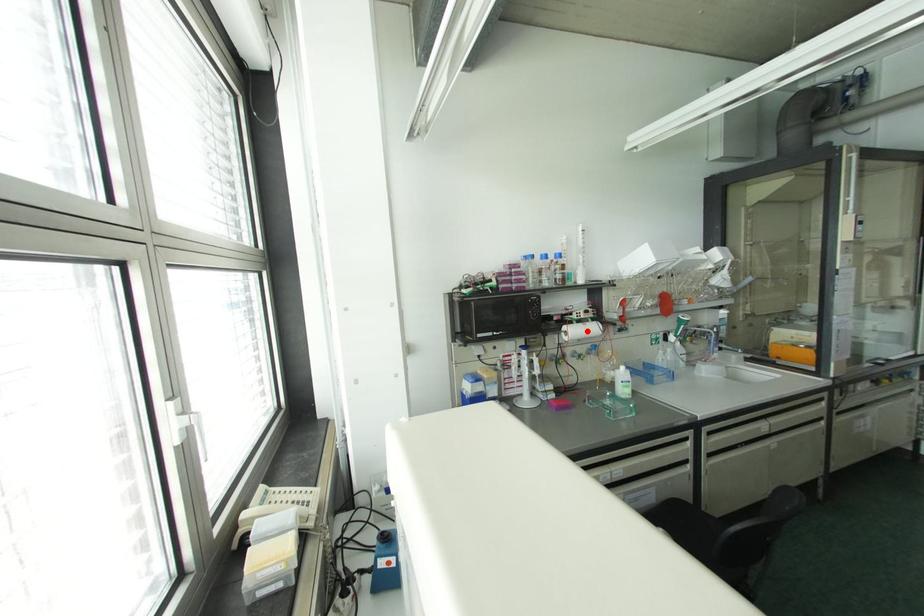
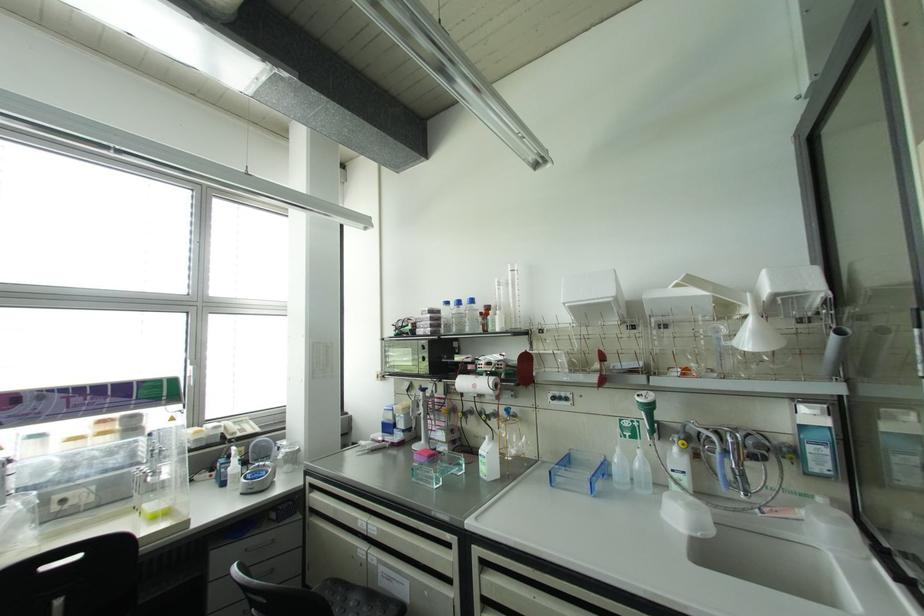
Where in the second image is the point corresponding to the highlighted location from the first image?

(473, 386)